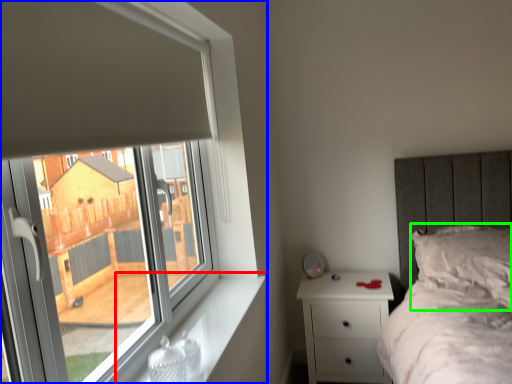
Question: Considering the real-world distances, which object is closest to window sill (highlighted by a red box)? window (highlighted by a blue box) or pillow (highlighted by a green box).

Choices:
 (A) window
 (B) pillow

Answer: (A)